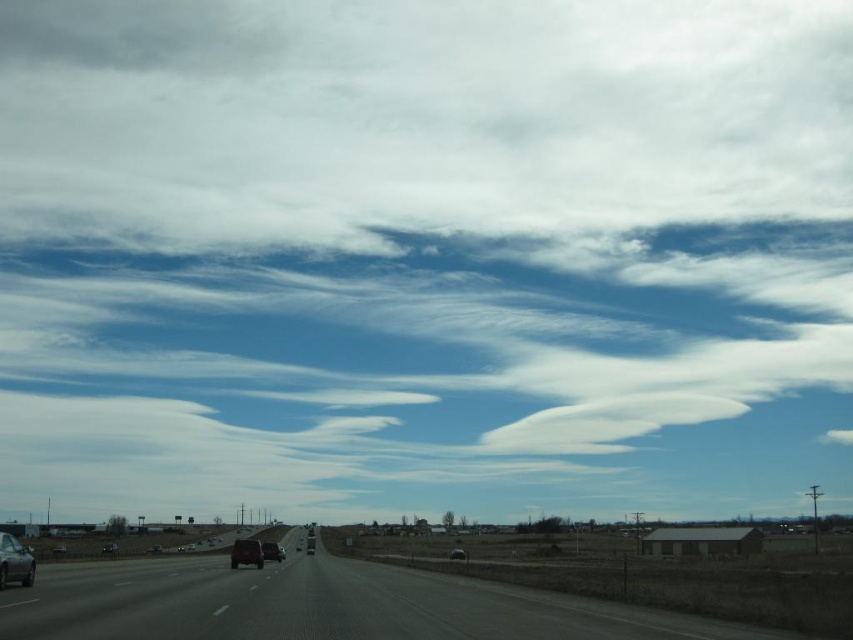
Question: Is matte black car at lower left in front of matte black car at center?

Choices:
 (A) no
 (B) yes

Answer: (B)

Question: Is white fluffy cloud at upper center thinner than smooth asphalt highway at center?

Choices:
 (A) no
 (B) yes

Answer: (A)

Question: Which object appears farthest from the camera in this image?

Choices:
 (A) white fluffy cloud at upper center
 (B) matte black car at center

Answer: (A)

Question: Which point is closer to the camera?

Choices:
 (A) (250, 561)
 (B) (457, 557)
 (C) (741, 134)
 (D) (109, 630)

Answer: (D)

Question: Which point is farther to the camera?

Choices:
 (A) (271, 556)
 (B) (459, 609)

Answer: (A)

Question: Can you confirm if smooth asphalt highway at center is thinner than matte black car at center?

Choices:
 (A) no
 (B) yes

Answer: (A)